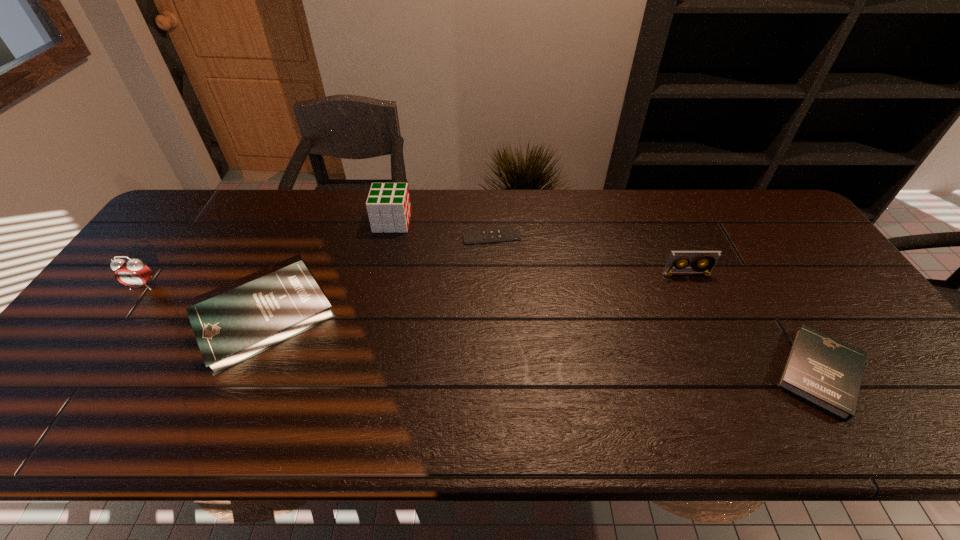
At what (x,y) coordinates should I click in order to perform the action: click on object located in the near right corner section of the desktop. Please return your answer as a coordinate pair (x, y). The height and width of the screenshot is (540, 960). Looking at the image, I should click on [826, 372].

Find the location of `vacant space at the far edge of the desktop`. vacant space at the far edge of the desktop is located at coordinates (517, 197).

You are a GUI agent. You are given a task and a screenshot of the screen. Output one action in this format:
    pyautogui.click(x=<x>, y=<y>)
    Task: Click on the vacant space at the near edge
    Image resolution: width=960 pixels, height=540 pixels.
    Given the screenshot: What is the action you would take?
    pyautogui.click(x=235, y=395)

Where is `vacant area at the left edge of the desktop`? vacant area at the left edge of the desktop is located at coordinates (97, 362).

This screenshot has width=960, height=540. In order to click on free space at the far left corner of the desktop in this screenshot , I will do `click(196, 218)`.

Where is `vacant space in between the cube and the leftmost object`? Image resolution: width=960 pixels, height=540 pixels. vacant space in between the cube and the leftmost object is located at coordinates (268, 254).

The width and height of the screenshot is (960, 540). In order to click on vacant space in between the third shortest object and the fifth object from left to right in this screenshot , I will do (475, 296).

Locate an element on the screen. The width and height of the screenshot is (960, 540). free space between the cube and the leftmost object is located at coordinates (268, 254).

You are a GUI agent. You are given a task and a screenshot of the screen. Output one action in this format:
    pyautogui.click(x=<x>, y=<y>)
    Task: Click on the free spot between the third shortest object and the fourth object from right to left
    The image size is (960, 540).
    Given the screenshot: What is the action you would take?
    pyautogui.click(x=328, y=269)

The height and width of the screenshot is (540, 960). I want to click on free space between the third shortest object and the fourth object from right to left, so 328,269.